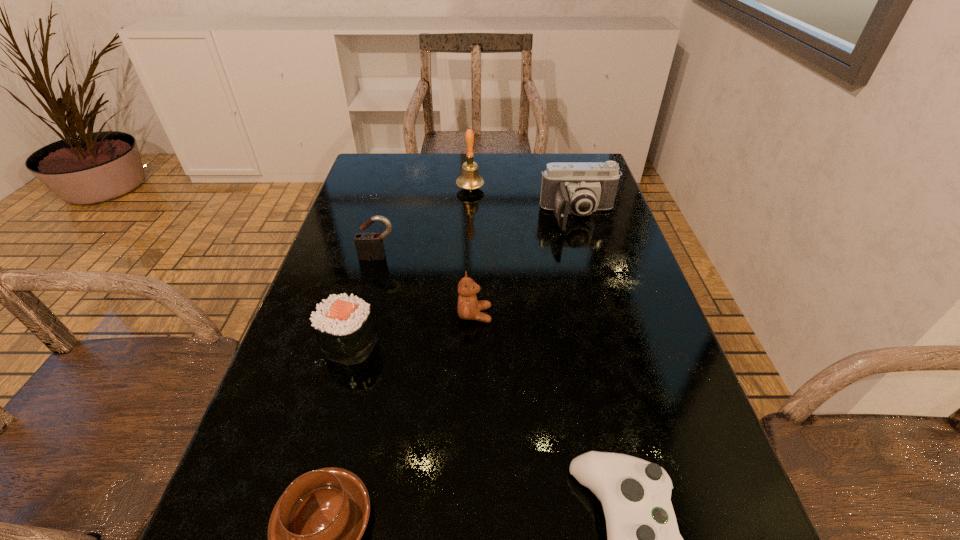
Where is `free region located on the front of the sushi`? The height and width of the screenshot is (540, 960). free region located on the front of the sushi is located at coordinates (307, 498).

Find the location of `object located in the far edge section of the desktop`. object located in the far edge section of the desktop is located at coordinates (469, 179).

In order to click on padlock present at the left edge in this screenshot , I will do `click(367, 245)`.

Find the location of a particular element. This screenshot has height=540, width=960. sushi situated at the left edge is located at coordinates (343, 324).

In order to click on object present at the right edge in this screenshot , I will do `click(580, 188)`.

The height and width of the screenshot is (540, 960). In order to click on blank space at the far edge of the desktop in this screenshot , I will do `click(414, 166)`.

The width and height of the screenshot is (960, 540). What are the coordinates of `free region at the left edge of the desktop` in the screenshot? It's located at (353, 240).

In the image, there is a desktop. At what (x,y) coordinates should I click in order to perform the action: click on vacant space at the right edge. Please return your answer as a coordinate pair (x, y). Looking at the image, I should click on (592, 270).

Locate an element on the screen. This screenshot has width=960, height=540. free space at the far left corner of the desktop is located at coordinates (368, 174).

In the image, there is a desktop. Where is `vacant space at the far right corner`? Image resolution: width=960 pixels, height=540 pixels. vacant space at the far right corner is located at coordinates (557, 160).